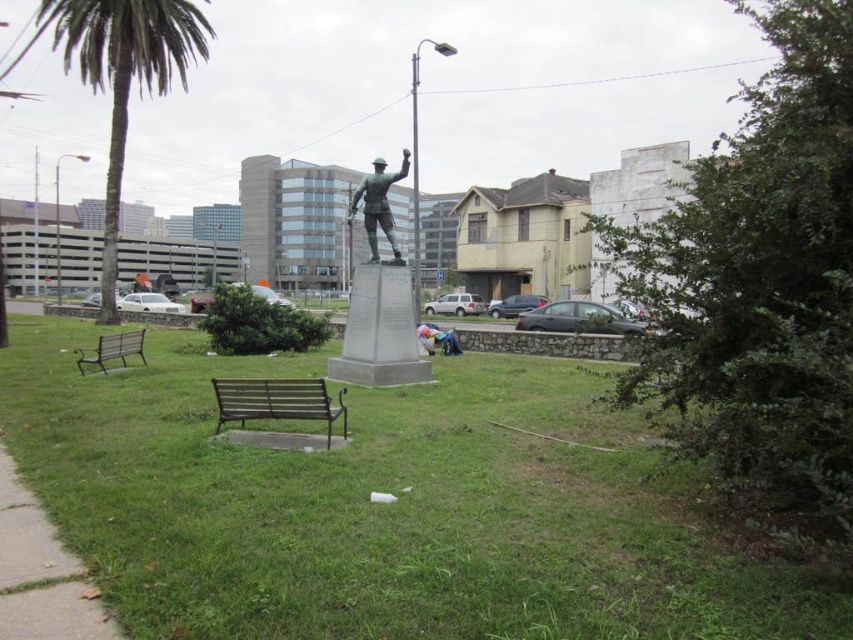
You are a maintenance worker needing to access the brown metal bench at lower left for repairs. The gray concrete sidewalk at lower left is in your way. Can you move the bench without removing the sidewalk?

The gray concrete sidewalk at lower left is positioned under the brown metal bench at lower left, so the bench is above the sidewalk. Since the sidewalk is under the bench, you can move the bench without needing to remove the sidewalk as they are separate structures.

You are standing in the urban park and want to take a photo of the green polished stone statue at center. If you are positioned at point A, which is at coordinates 0.3, 0.3, can you directly see the statue without any obstructions?

The green polished stone statue at center is located at point (379,300). Since your position at (254,192) is close but not directly behind any objects mentioned in the scene, you should have a clear view of the statue unless there are other unmentioned obstructions.

You are a photographer planning to take a photo of the green polished stone statue at center and the blue denim jeans at center in the urban park. Since you want to highlight both subjects equally, which one should you move closer to the camera to achieve balance?

The blue denim jeans at center should be moved closer to the camera because the green polished stone statue at center is larger in size, so bringing the smaller blue denim jeans at center nearer will help balance their sizes in the photo.